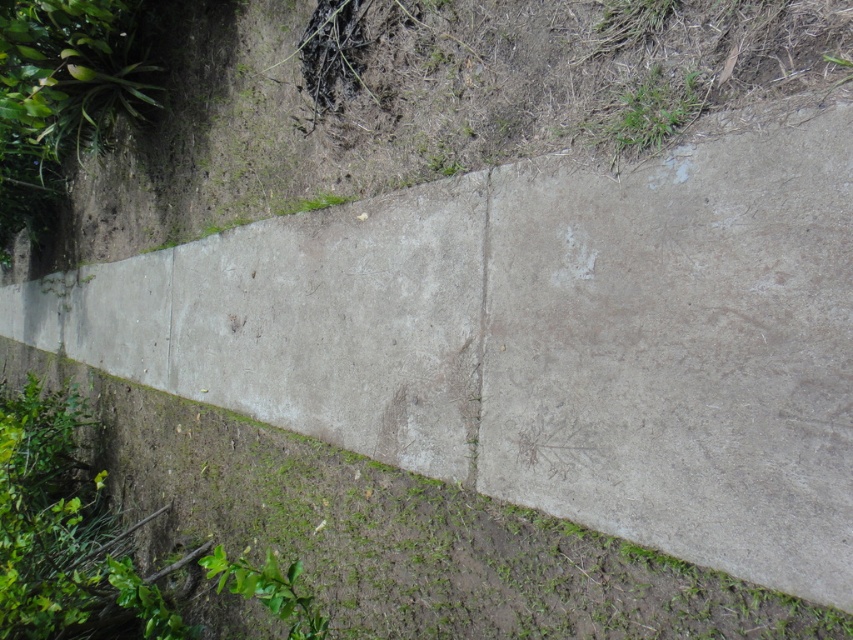
You are a construction inspector examining the pathway. You notice a point at coordinates (408, 100). Based on the scene, what material is located at that point?

The point at coordinates (408, 100) indicates rough concrete at upper left.

You are a gardener planning to repair the pathway. You need to know which area is wider between the rough concrete at upper left and the gray concrete crack at center to decide where to apply more repair material. Which one is wider?

The rough concrete at upper left is wider than the gray concrete crack at center, so you should apply more repair material there.

You are standing at the origin point of the image. You need to walk to the rough concrete at upper left. Which direction should you move in to reach it?

Since the rough concrete at upper left is located at point 0.159 on the x and 0.479 on the y, you should move towards the upper left direction to reach it.